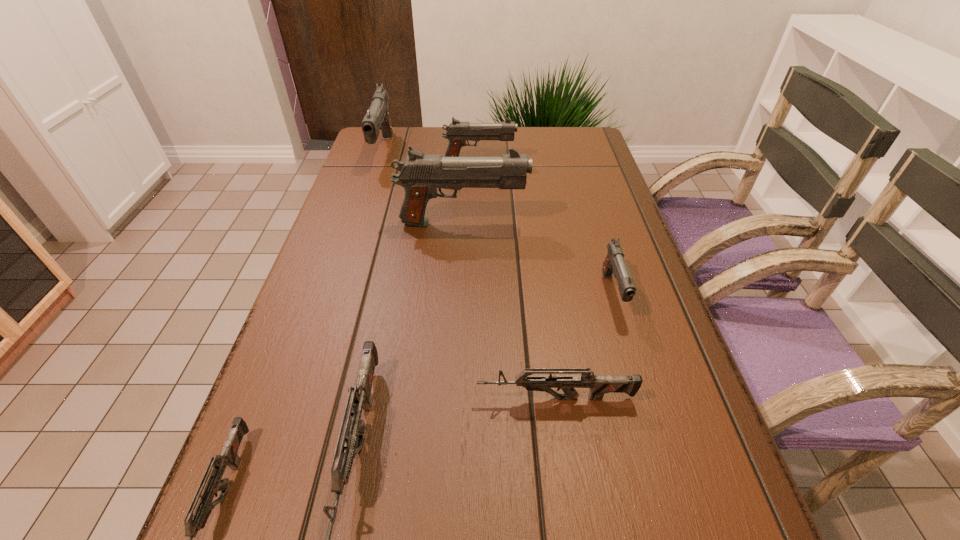
In the image, there is a desktop. Where is `vacant region at the left edge`? This screenshot has width=960, height=540. vacant region at the left edge is located at coordinates (270, 423).

This screenshot has width=960, height=540. In the image, there is a desktop. Identify the location of vacant space at the right edge. (660, 460).

The width and height of the screenshot is (960, 540). In the image, there is a desktop. In order to click on vacant region at the far right corner in this screenshot , I will do 596,159.

This screenshot has height=540, width=960. What are the coordinates of `vacant region between the third tallest object and the second biggest grey gun` in the screenshot? It's located at (517, 280).

The height and width of the screenshot is (540, 960). What are the coordinates of `vacant space that is in between the second biggest grey gun and the fifth nearest gun` in the screenshot? It's located at (509, 310).

Locate which object is the closest to the biggest gray gun. Please provide its 2D coordinates. Your answer should be formatted as a tuple, i.e. [(x, y)], where the tuple contains the x and y coordinates of a point satisfying the conditions above.

[(614, 263)]

Select which object is the closest to the third biggest gray gun. Please provide its 2D coordinates. Your answer should be formatted as a tuple, i.e. [(x, y)], where the tuple contains the x and y coordinates of a point satisfying the conditions above.

[(377, 118)]

Locate which gun is the fifth closest to the second shortest gun. Please provide its 2D coordinates. Your answer should be formatted as a tuple, i.e. [(x, y)], where the tuple contains the x and y coordinates of a point satisfying the conditions above.

[(458, 132)]

Choose which gun is the sixth nearest neighbor to the rightmost object. Please provide its 2D coordinates. Your answer should be formatted as a tuple, i.e. [(x, y)], where the tuple contains the x and y coordinates of a point satisfying the conditions above.

[(377, 118)]

Identify the location of gray gun that is the closest to the second biggest grey gun. This screenshot has height=540, width=960. (614, 263).